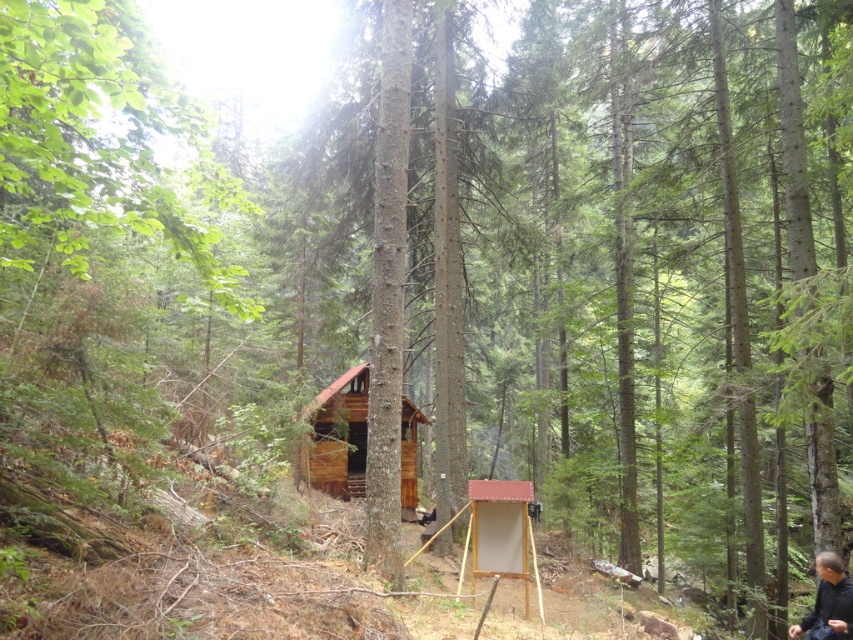
Question: Estimate the real-world distances between objects in this image. Which object is closer to the brown wooden log cabin at center?

Choices:
 (A) dark brown leather jacket at lower right
 (B) white cardboard at center

Answer: (B)

Question: Is brown wooden log cabin at center further to the viewer compared to white cardboard at center?

Choices:
 (A) no
 (B) yes

Answer: (B)

Question: Among these objects, which one is nearest to the camera?

Choices:
 (A) brown wooden log cabin at center
 (B) dark brown leather jacket at lower right
 (C) white cardboard at center

Answer: (B)

Question: Which point is farther to the camera?

Choices:
 (A) brown wooden log cabin at center
 (B) white cardboard at center
 (C) dark brown leather jacket at lower right

Answer: (A)

Question: Does brown wooden log cabin at center lie in front of dark brown leather jacket at lower right?

Choices:
 (A) yes
 (B) no

Answer: (B)

Question: Does white cardboard at center lie behind dark brown leather jacket at lower right?

Choices:
 (A) no
 (B) yes

Answer: (B)